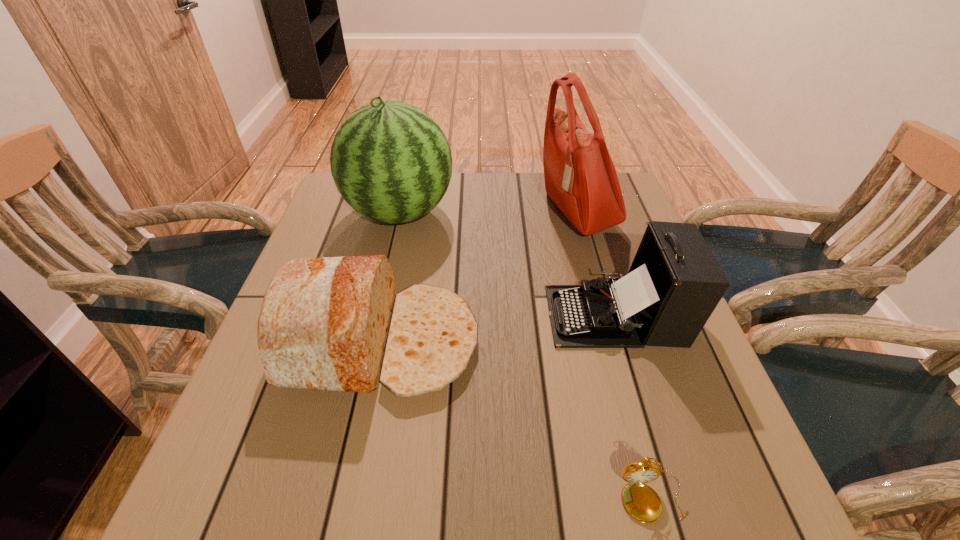
Image resolution: width=960 pixels, height=540 pixels. What are the coordinates of `typewriter at the right edge` in the screenshot? It's located at (674, 284).

Where is `pocket watch situated at the right edge`? The height and width of the screenshot is (540, 960). pocket watch situated at the right edge is located at coordinates (641, 501).

The height and width of the screenshot is (540, 960). In order to click on object located in the far left corner section of the desktop in this screenshot , I will do `click(391, 162)`.

Identify the location of object that is at the far right corner. (580, 177).

Find the location of a particular element. object that is positioned at the near right corner is located at coordinates (641, 501).

This screenshot has height=540, width=960. In the image, there is a desktop. Identify the location of free space at the far edge. (490, 187).

Identify the location of free space at the near edge. (507, 478).

Locate an element on the screen. Image resolution: width=960 pixels, height=540 pixels. vacant space at the right edge of the desktop is located at coordinates (629, 241).

Identify the location of vacant space at the near left corner. (281, 477).

This screenshot has height=540, width=960. In the image, there is a desktop. What are the coordinates of `vacant space at the far right corner` in the screenshot? It's located at (619, 172).